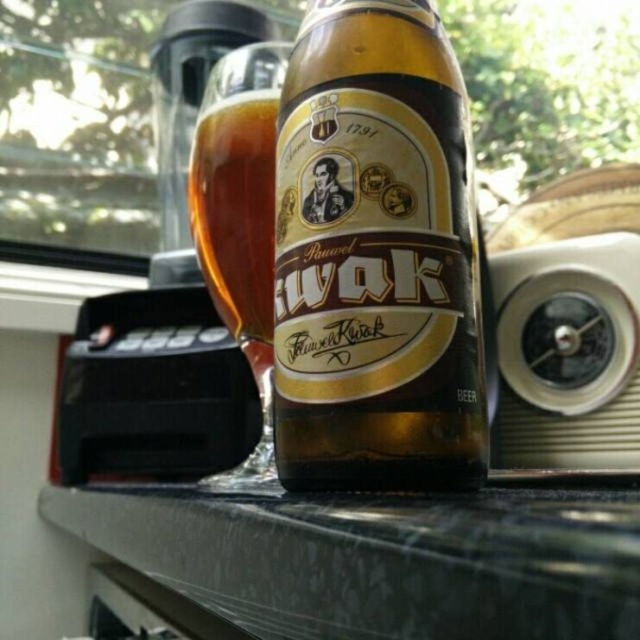
You are at a bar and want to pour the beer from the brown glass beer bottle at center into the amber glass mug at upper center. Will the mug hold all the beer from the bottle?

The brown glass beer bottle at center is bigger than the amber glass mug at upper center, so the mug may not hold all the beer from the bottle.

You are a bartender who needs to place a coaster between the brown glass beer bottle at center and the black marble counter at center to prevent condensation damage. The coaster you have is 5 inches in diameter. Will it fit perfectly between them?

The brown glass beer bottle at center and the black marble counter at center are 5.08 inches apart from each other. Since the coaster is 5 inches in diameter, it will fit perfectly between them with a slight gap of 0.08 inches.